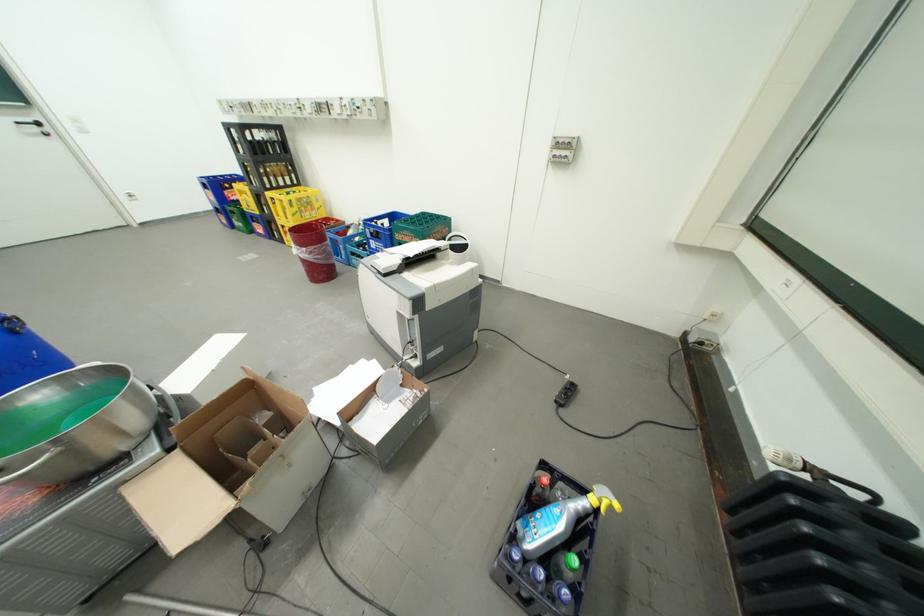
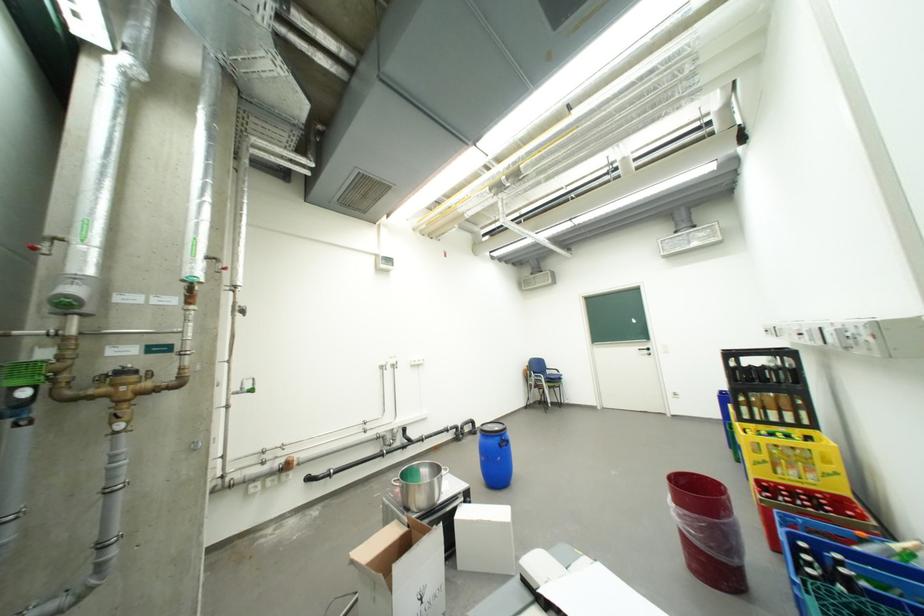
Locate, in the second image, the point that corresponds to (322,219) in the first image.

(810, 484)